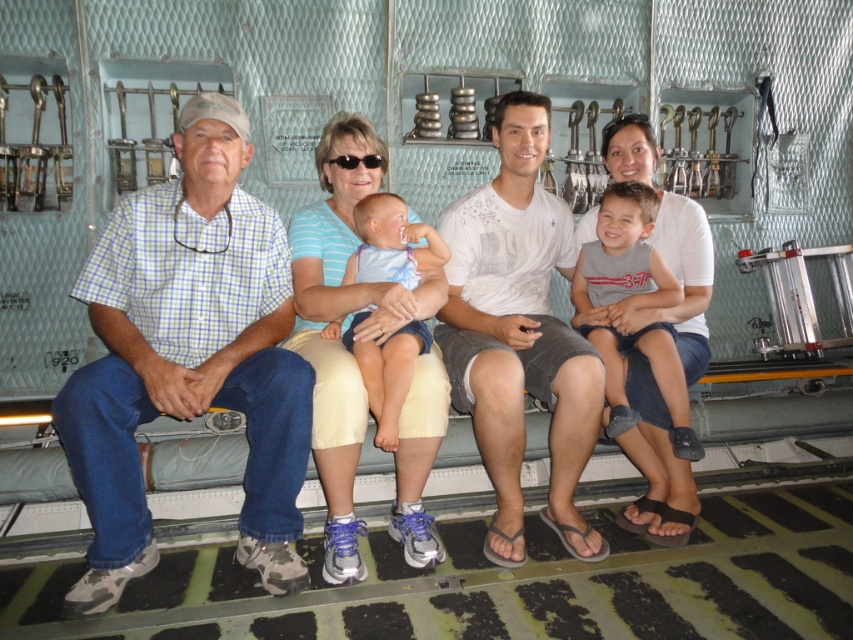
Question: Which object is closer to the camera taking this photo?

Choices:
 (A) gray cotton shirt at center
 (B) light blue fabric baby at center
 (C) matte white shirt at center
 (D) white cotton shirt at center

Answer: (C)

Question: Is checkered fabric shirt at left smaller than light blue striped shirt at center?

Choices:
 (A) no
 (B) yes

Answer: (A)

Question: Which of these objects is positioned farthest from the gray cotton shirt at center?

Choices:
 (A) white cotton shirt at center
 (B) light blue fabric baby at center

Answer: (B)

Question: Which is farther from the light blue striped shirt at center?

Choices:
 (A) checkered fabric shirt at left
 (B) light blue fabric baby at center
 (C) white cotton shirt at center

Answer: (C)

Question: Does matte white shirt at center appear on the left side of white cotton shirt at center?

Choices:
 (A) no
 (B) yes

Answer: (B)

Question: Is checkered fabric shirt at left positioned in front of light blue fabric baby at center?

Choices:
 (A) yes
 (B) no

Answer: (A)